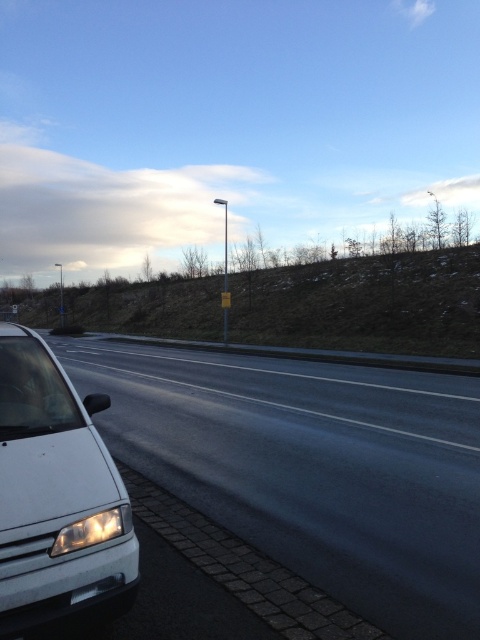
You are driving a car and see the white matte van at left and the matte white headlight at lower left in your rearview mirror. Which object is closer to your car?

The matte white headlight at lower left is closer to your car because it is positioned to the right of the white matte van at left, meaning it is nearer to the observer from the rearview mirror perspective.

You are standing at the center of the road and want to walk to the black asphalt highway at left. What direction should you head towards?

The black asphalt highway at left is located at coordinates point (x=312, y=467), so you should head towards the left direction.

You are a driver approaching the black asphalt highway at left and the matte white headlight at lower left. Which object appears larger in the scene?

The black asphalt highway at left appears larger than the matte white headlight at lower left.